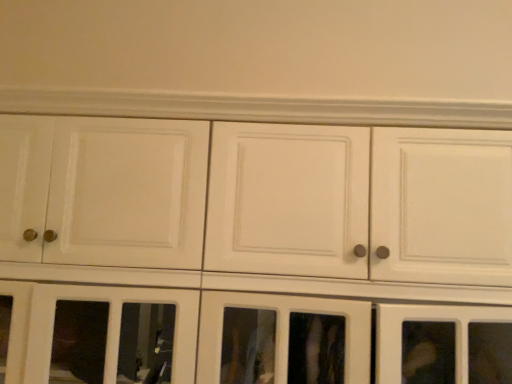
This screenshot has width=512, height=384. What do you see at coordinates (259, 207) in the screenshot?
I see `white matte cabinet at center` at bounding box center [259, 207].

Image resolution: width=512 pixels, height=384 pixels. In order to click on white matte cabinet at center in this screenshot , I will do `click(259, 207)`.

This screenshot has width=512, height=384. Find the location of `white matte cabinet at center`. white matte cabinet at center is located at coordinates (259, 207).